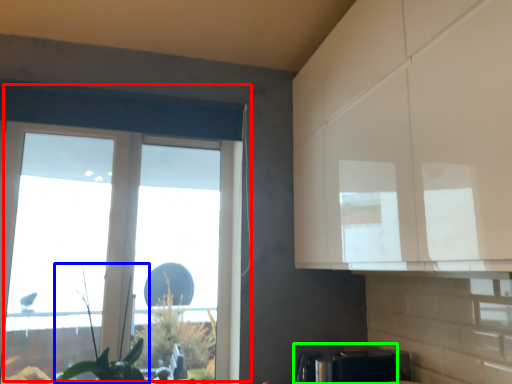
Question: Which object is the closest to the window (highlighted by a red box)? Choose among these: plant (highlighted by a blue box) or appliance (highlighted by a green box).

Choices:
 (A) plant
 (B) appliance

Answer: (A)